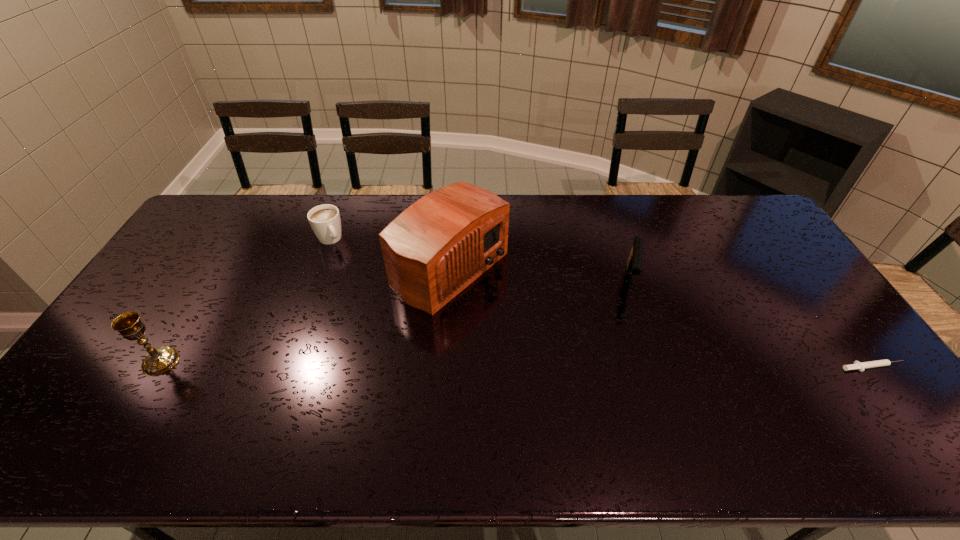
The image size is (960, 540). Identify the location of free space on the desktop that is between the leftmost object and the shortest object and is positioned with the handle on the side of the second object from left to right. (416, 363).

You are a GUI agent. You are given a task and a screenshot of the screen. Output one action in this format:
    pyautogui.click(x=<x>, y=<y>)
    Task: Click on the free space on the desktop that is between the second tallest object and the syringe and is positioned at the barrel of the pistol
    This screenshot has height=540, width=960.
    Given the screenshot: What is the action you would take?
    pyautogui.click(x=622, y=365)

Identify the location of free space on the desktop that is between the fourth shortest object and the shortest object and is positioned on the front-facing side of the third object from left to right. The height and width of the screenshot is (540, 960). (607, 365).